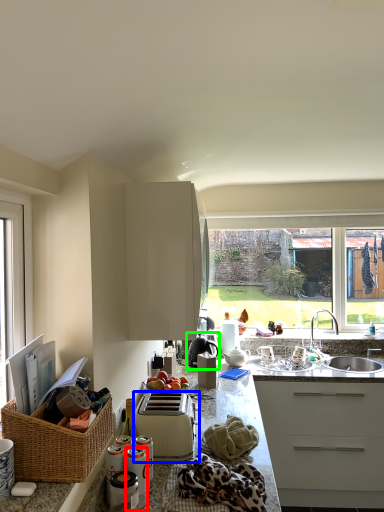
Question: Which object is the farthest from appliance (highlighted by a red box)? Choose among these: toaster (highlighted by a blue box) or appliance (highlighted by a green box).

Choices:
 (A) toaster
 (B) appliance

Answer: (B)